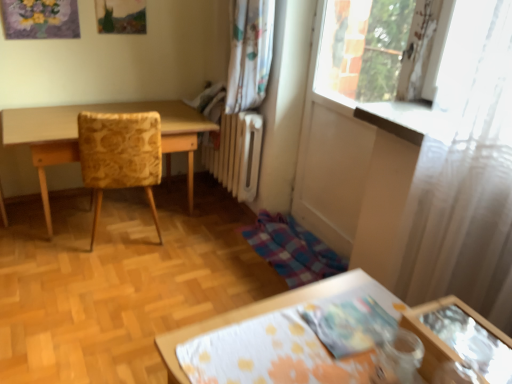
The width and height of the screenshot is (512, 384). I want to click on free space below light wood table at left (from a real-world perspective), so click(x=120, y=207).